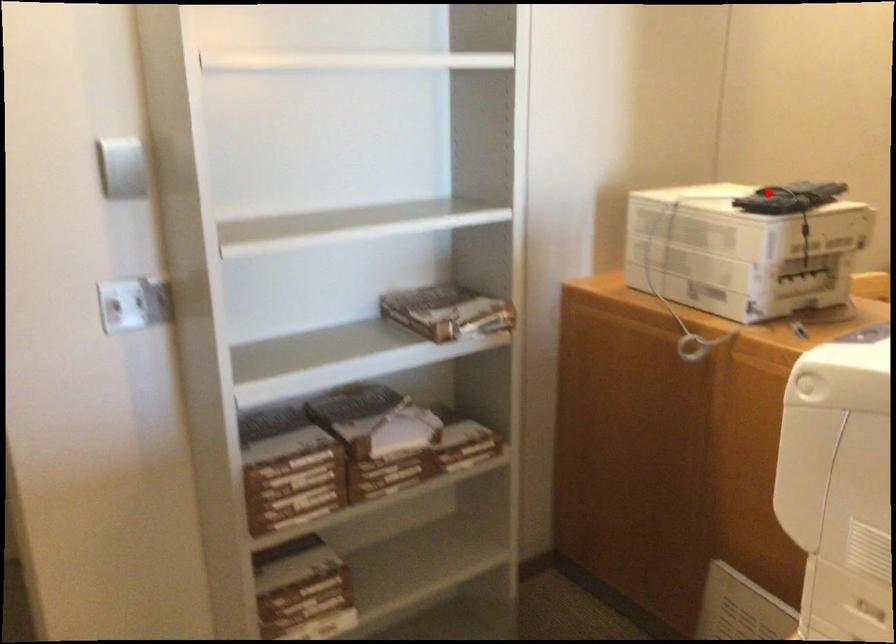
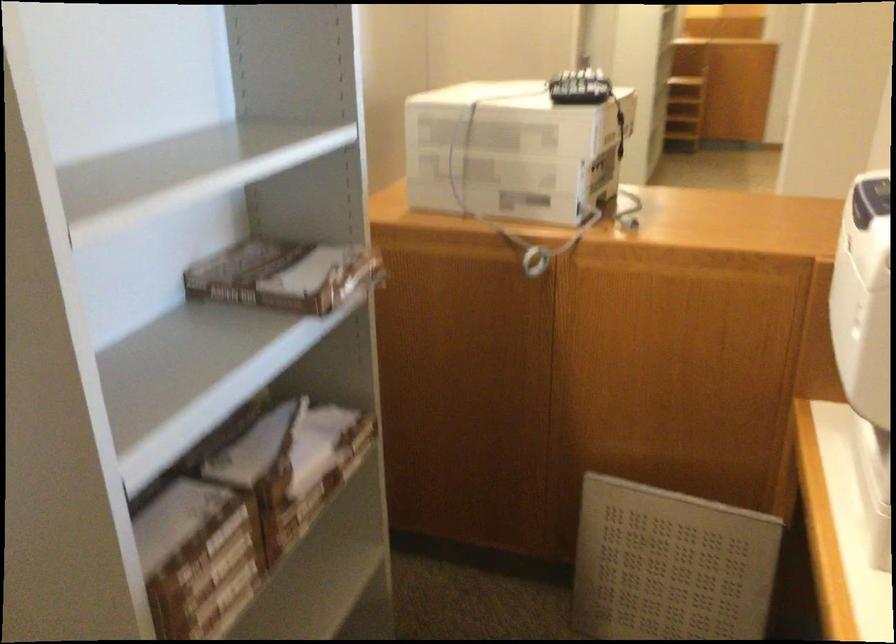
The point at the highlighted location is marked in the first image. Where is the corresponding point in the second image?

(580, 87)